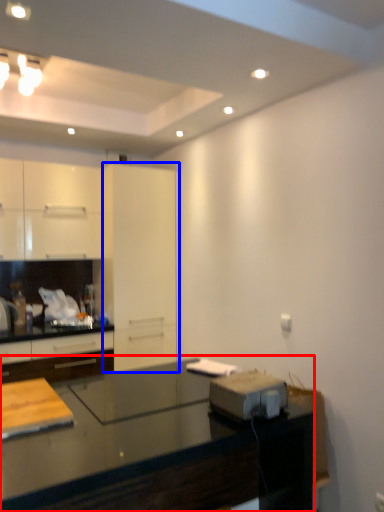
Question: Which point is closer to the camera, countertop (highlighted by a red box) or glass door (highlighted by a blue box)?

Choices:
 (A) countertop
 (B) glass door

Answer: (A)